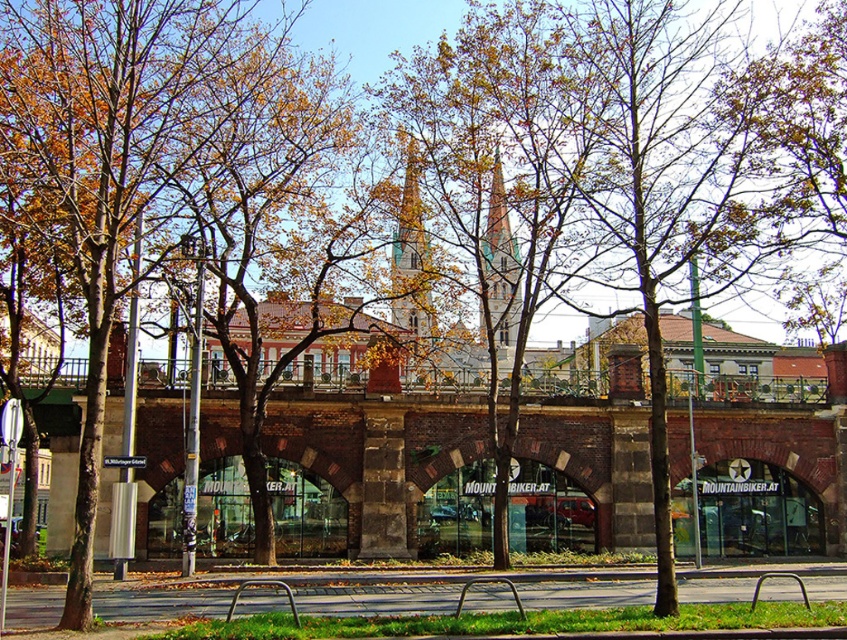
Question: Is green stone spire at center thinner than metallic silver bench at center?

Choices:
 (A) yes
 (B) no

Answer: (A)

Question: Does brown stone bridge at center appear on the right side of green stone tower at center?

Choices:
 (A) no
 (B) yes

Answer: (A)

Question: Which of the following is the closest to the observer?

Choices:
 (A) green stone spire at center
 (B) brown leafy tree at left
 (C) green stone tower at center

Answer: (B)

Question: Is green leafy tree at center positioned behind metallic silver bench at center?

Choices:
 (A) no
 (B) yes

Answer: (B)

Question: Which object is closer to the camera taking this photo?

Choices:
 (A) green stone spire at center
 (B) green stone tower at center
 (C) brown stone bridge at center
 (D) metallic silver bench at center

Answer: (D)

Question: Which object is the closest to the green stone spire at center?

Choices:
 (A) brown leafy tree at left
 (B) green leafy tree at center
 (C) metallic silver bench at center

Answer: (B)